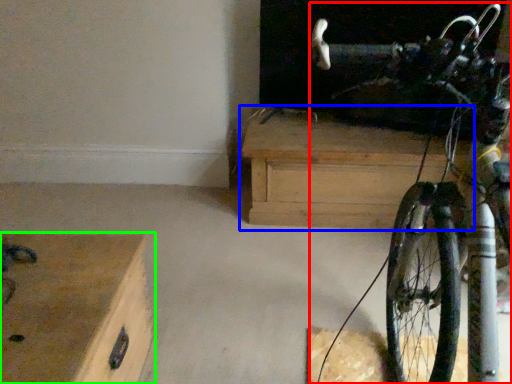
Question: Which object is positioned closest to bicycle (highlighted by a red box)? Select from chest of drawers (highlighted by a blue box) and chest of drawers (highlighted by a green box).

Choices:
 (A) chest of drawers
 (B) chest of drawers

Answer: (A)